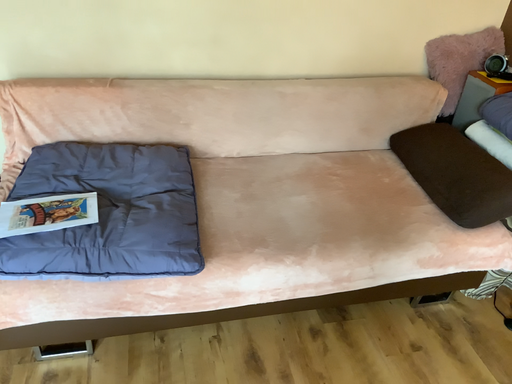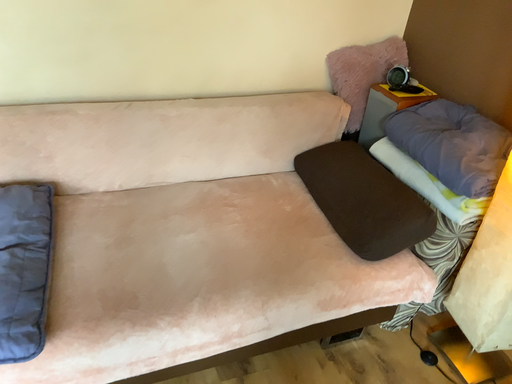
Question: How did the camera likely rotate when shooting the video?

Choices:
 (A) rotated left
 (B) rotated right

Answer: (B)